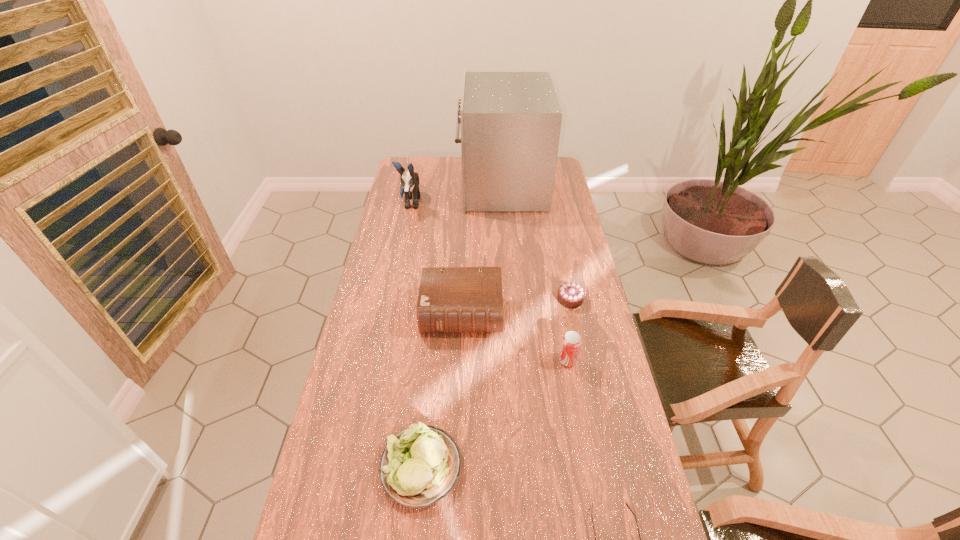
Identify the location of toaster oven located in the right edge section of the desktop. The height and width of the screenshot is (540, 960). 510,122.

The height and width of the screenshot is (540, 960). I want to click on soda can that is at the right edge, so click(x=571, y=342).

Locate an element on the screen. The image size is (960, 540). chocolate cake present at the right edge is located at coordinates (571, 295).

Find the location of a particular element. object that is at the far right corner is located at coordinates (510, 122).

In the image, there is a desktop. Identify the location of free space at the far edge. This screenshot has width=960, height=540. (459, 173).

Locate an element on the screen. free space at the left edge of the desktop is located at coordinates (327, 458).

You are a GUI agent. You are given a task and a screenshot of the screen. Output one action in this format:
    pyautogui.click(x=<x>, y=<y>)
    Task: Click on the free space at the right edge
    Image resolution: width=960 pixels, height=540 pixels.
    Given the screenshot: What is the action you would take?
    [x=620, y=388]

You are a GUI agent. You are given a task and a screenshot of the screen. Output one action in this format:
    pyautogui.click(x=<x>, y=<y>)
    Task: Click on the unoccupied position between the third shortest object and the fifth farthest object
    The image size is (960, 540).
    Given the screenshot: What is the action you would take?
    pyautogui.click(x=494, y=414)

Where is `free space between the toaster oven and the leftmost object`? The width and height of the screenshot is (960, 540). free space between the toaster oven and the leftmost object is located at coordinates (456, 195).

Find the location of `vacant area between the second shortest object and the third shortest object`. vacant area between the second shortest object and the third shortest object is located at coordinates (495, 383).